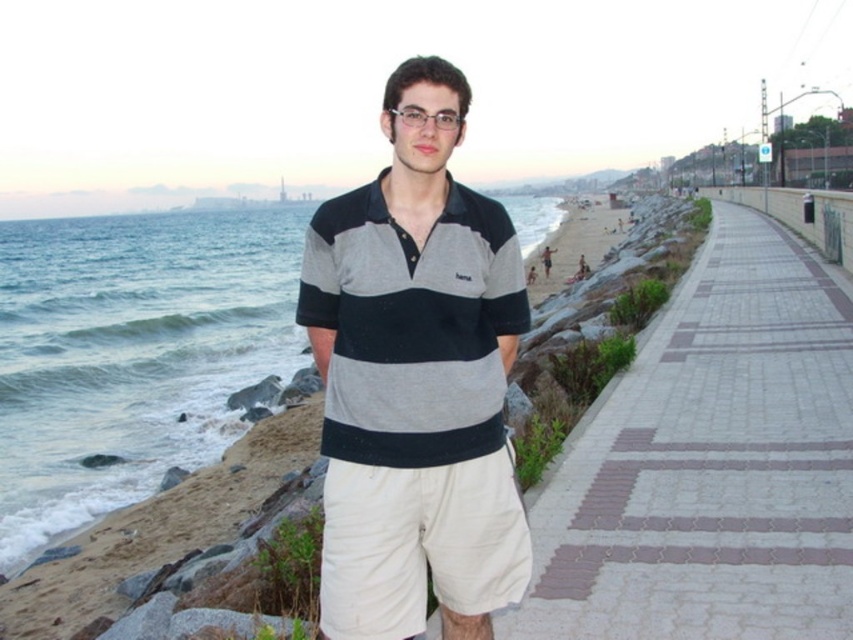
Based on the scene description, which clothing item is wider when viewed from the front? The striped cotton polo shirt at center or the beige cotton shorts at center?

The striped cotton polo shirt at center is wider than the beige cotton shorts at center.

You are standing at the center of the image and want to walk towards the paved stone walkway at right. In which general direction should you move?

Since the paved stone walkway at right is located at point (712, 464) in the image, you should move towards the right side to reach it.